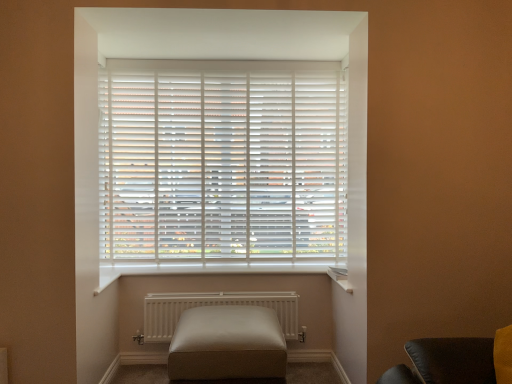
Question: Considering the relative positions of white matte radiator at center and leather ottoman at center in the image provided, is white matte radiator at center in front of leather ottoman at center?

Choices:
 (A) no
 (B) yes

Answer: (A)

Question: From a real-world perspective, is white matte radiator at center over leather ottoman at center?

Choices:
 (A) yes
 (B) no

Answer: (A)

Question: Can you confirm if white matte radiator at center is positioned to the left of leather ottoman at center?

Choices:
 (A) yes
 (B) no

Answer: (A)

Question: Considering the relative positions of white matte radiator at center and leather ottoman at center in the image provided, is white matte radiator at center behind leather ottoman at center?

Choices:
 (A) no
 (B) yes

Answer: (B)

Question: Is white matte radiator at center aimed at leather ottoman at center?

Choices:
 (A) yes
 (B) no

Answer: (A)

Question: Can you confirm if white matte radiator at center is thinner than leather ottoman at center?

Choices:
 (A) yes
 (B) no

Answer: (A)

Question: Does white matte radiator at center have a lesser width compared to white matte blinds at center?

Choices:
 (A) no
 (B) yes

Answer: (A)

Question: From a real-world perspective, is white matte radiator at center under white matte blinds at center?

Choices:
 (A) no
 (B) yes

Answer: (B)

Question: Can you confirm if white matte radiator at center is smaller than white matte blinds at center?

Choices:
 (A) yes
 (B) no

Answer: (A)

Question: Is the position of white matte radiator at center less distant than that of white matte blinds at center?

Choices:
 (A) yes
 (B) no

Answer: (A)

Question: Is white matte radiator at center turned away from white matte blinds at center?

Choices:
 (A) yes
 (B) no

Answer: (B)

Question: Does white matte radiator at center appear on the right side of white matte blinds at center?

Choices:
 (A) yes
 (B) no

Answer: (A)

Question: From the image's perspective, does leather ottoman at center appear higher than white matte blinds at center?

Choices:
 (A) yes
 (B) no

Answer: (B)